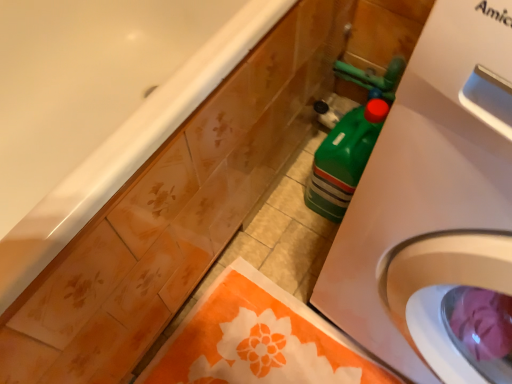
Question: Considering the positions of white glossy bathtub at upper left and orange fabric towel at lower center in the image, is white glossy bathtub at upper left wider or thinner than orange fabric towel at lower center?

Choices:
 (A) thin
 (B) wide

Answer: (B)

Question: Considering the relative positions of white glossy bathtub at upper left and orange fabric towel at lower center in the image provided, is white glossy bathtub at upper left to the left or to the right of orange fabric towel at lower center?

Choices:
 (A) left
 (B) right

Answer: (A)

Question: Which is farther from the orange fabric towel at lower center?

Choices:
 (A) white plastic washing machine at right
 (B) white glossy bathtub at upper left

Answer: (B)

Question: Which is farther from the white glossy bathtub at upper left?

Choices:
 (A) orange fabric towel at lower center
 (B) white plastic washing machine at right

Answer: (A)